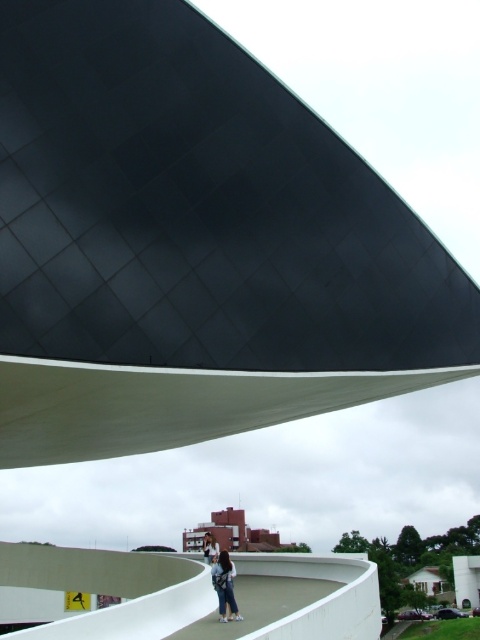
Question: Which object is closer to the camera taking this photo?

Choices:
 (A) brick building at lower center
 (B) black matte/texture roof at upper center
 (C) white smooth ramp at lower center
 (D) denim pants at lower center

Answer: (C)

Question: Observing the image, what is the correct spatial positioning of white smooth ramp at lower center in reference to denim pants at lower center?

Choices:
 (A) left
 (B) right

Answer: (A)

Question: Can you confirm if black matte/texture roof at upper center is thinner than denim pants at lower center?

Choices:
 (A) yes
 (B) no

Answer: (B)

Question: Which object is the farthest from the black matte/texture roof at upper center?

Choices:
 (A) denim pants at lower center
 (B) white smooth ramp at lower center
 (C) brick building at lower center

Answer: (C)

Question: Is brick building at lower center wider than denim pants at lower center?

Choices:
 (A) yes
 (B) no

Answer: (A)

Question: Estimate the real-world distances between objects in this image. Which object is closer to the white smooth ramp at lower center?

Choices:
 (A) brick building at lower center
 (B) black matte/texture roof at upper center

Answer: (B)